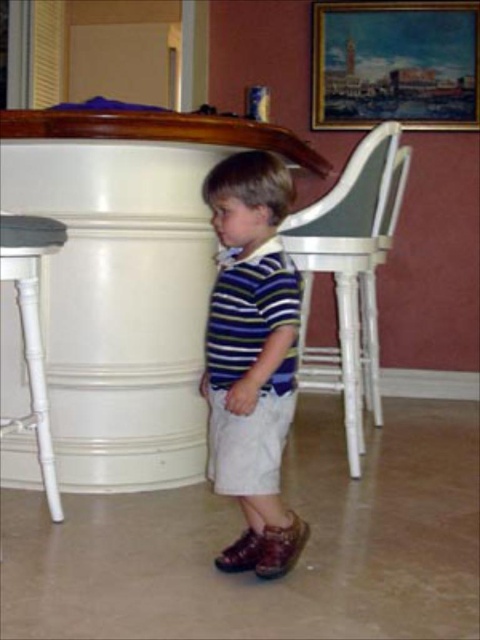
You are arranging a small plant that is 1 meter wide. You want to place it between the white glossy table at left and the oil painting at upper right. Which object should the plant be placed closer to to ensure it fits?

The white glossy table at left is wider than the oil painting at upper right, so the plant should be placed closer to the oil painting at upper right to ensure it fits within the available space.